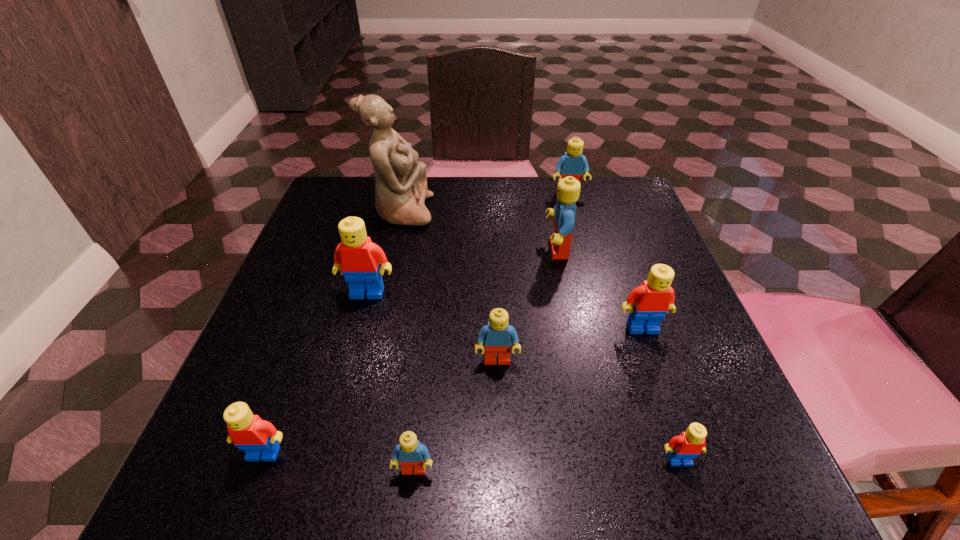
Where is `free spot located 0.200m on the face of the biggest red Lego`? This screenshot has width=960, height=540. free spot located 0.200m on the face of the biggest red Lego is located at coordinates (342, 389).

The width and height of the screenshot is (960, 540). Find the location of `vacant space located 0.100m on the face of the second biggest blue Lego`. vacant space located 0.100m on the face of the second biggest blue Lego is located at coordinates (576, 220).

Locate an element on the screen. free location located 0.150m on the face of the third nearest red Lego is located at coordinates (671, 410).

This screenshot has width=960, height=540. Find the location of `free space located 0.100m on the face of the fourth nearest object`. free space located 0.100m on the face of the fourth nearest object is located at coordinates (499, 423).

You are a GUI agent. You are given a task and a screenshot of the screen. Output one action in this format:
    pyautogui.click(x=<x>, y=<y>)
    Task: Click on the figurine at the far edge
    
    Given the screenshot: What is the action you would take?
    pyautogui.click(x=401, y=188)

At what (x,y) coordinates should I click in order to perform the action: click on Lego present at the far edge. Please return your answer as a coordinate pair (x, y). Image resolution: width=960 pixels, height=540 pixels. Looking at the image, I should click on (572, 163).

Find the location of a particular element. The image size is (960, 540). figurine that is positioned at the left edge is located at coordinates (401, 188).

In order to click on object at the far left corner in this screenshot , I will do `click(401, 188)`.

The height and width of the screenshot is (540, 960). I want to click on object that is at the near left corner, so click(x=258, y=438).

Find the location of `object present at the far right corner`. object present at the far right corner is located at coordinates (572, 163).